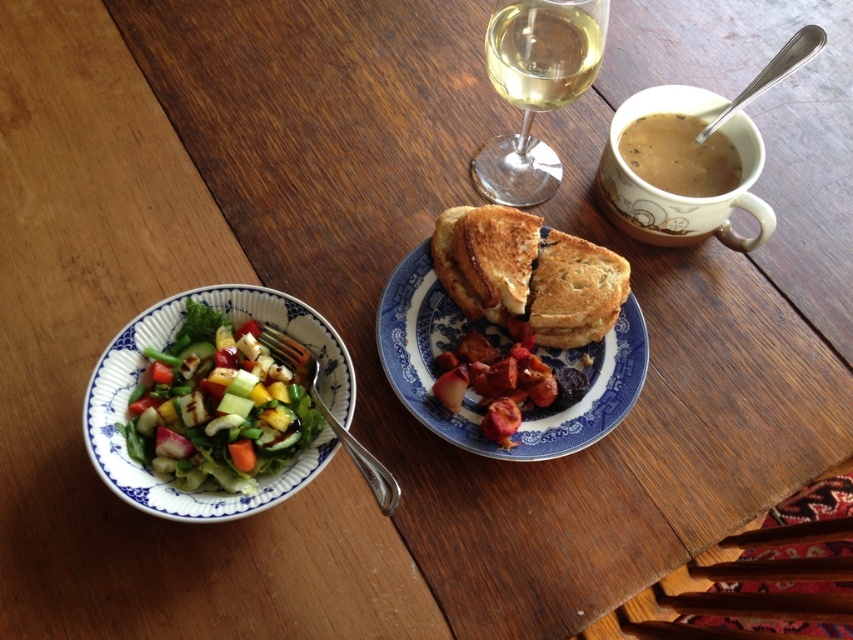
Looking at this image, which of these two, toasted bread at center or brown toasted sandwich at center, stands taller?

toasted bread at center is taller.

Is toasted bread at center to the left of brown toasted sandwich at center from the viewer's perspective?

Correct, you'll find toasted bread at center to the left of brown toasted sandwich at center.

Between point (415, 394) and point (531, 276), which one is positioned behind?

The point (531, 276) is more distant.

You are a GUI agent. You are given a task and a screenshot of the screen. Output one action in this format:
    pyautogui.click(x=<x>, y=<y>)
    Task: Click on the toasted bread at center
    This screenshot has height=640, width=853.
    Given the screenshot: What is the action you would take?
    pyautogui.click(x=502, y=349)

Who is more forward, (537, 60) or (508, 19)?

Point (508, 19) is in front.

Does point (497, 40) lie behind point (519, 74)?

Yes, point (497, 40) is behind point (519, 74).

Where is `transparent glass wine glass at upper center`? This screenshot has height=640, width=853. transparent glass wine glass at upper center is located at coordinates (535, 88).

What do you see at coordinates (218, 406) in the screenshot?
I see `fresh green salad at left` at bounding box center [218, 406].

Is point (274, 352) behind point (583, 292)?

No, (274, 352) is closer to viewer.

Where is `fresh green salad at left`? This screenshot has width=853, height=640. fresh green salad at left is located at coordinates (218, 406).